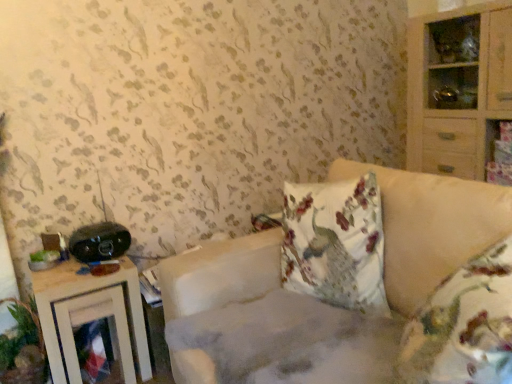
Question: Is point (66, 294) closer or farther from the camera than point (12, 369)?

Choices:
 (A) closer
 (B) farther

Answer: (A)

Question: Relative to green leafy plant at lower left, is wooden nightstand at left in front or behind?

Choices:
 (A) behind
 (B) front

Answer: (A)

Question: Which object is the closest to the wooden nightstand at left?

Choices:
 (A) black plastic stereo at left
 (B) fluffy beige couch at center
 (C) green leafy plant at lower left
 (D) light wood cabinet at right

Answer: (A)

Question: Which object is the farthest from the wooden nightstand at left?

Choices:
 (A) light wood cabinet at right
 (B) green leafy plant at lower left
 (C) fluffy beige couch at center
 (D) black plastic stereo at left

Answer: (A)